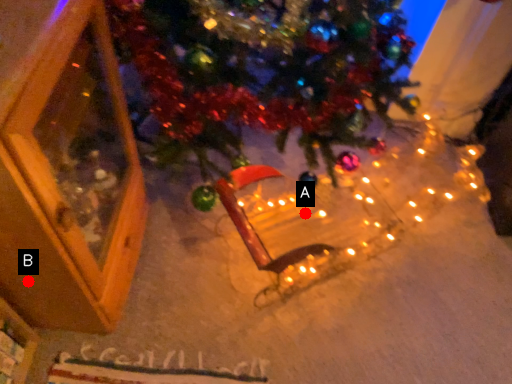
Question: Two points are circled on the image, labeled by A and B beside each circle. Among these points, which one is farthest from the camera?

Choices:
 (A) A is further
 (B) B is further

Answer: (A)